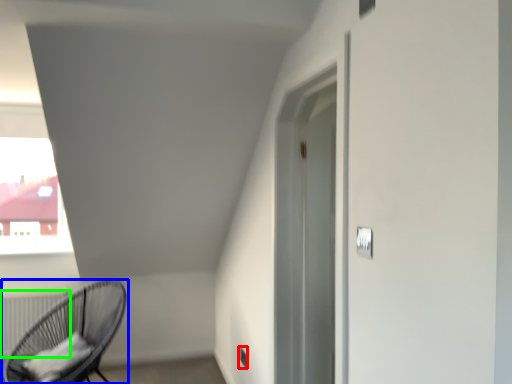
Question: Which object is positioned farthest from electric outlet (highlighted by a red box)? Select from chair (highlighted by a blue box) and radiator (highlighted by a green box).

Choices:
 (A) chair
 (B) radiator

Answer: (B)